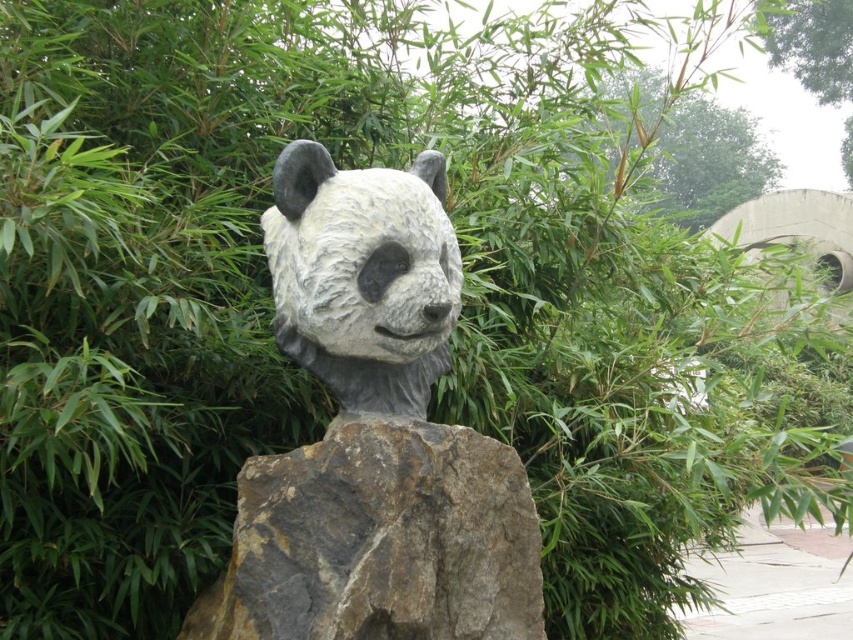
Question: Which object appears farthest from the camera in this image?

Choices:
 (A) gray rough rock at center
 (B) white stone panda head at center
 (C) green leafy tree at upper right

Answer: (C)

Question: Which object is closer to the camera taking this photo?

Choices:
 (A) gray rough rock at center
 (B) green leafy tree at upper right
 (C) white stone panda head at center

Answer: (C)

Question: Which point is closer to the camera taking this photo?

Choices:
 (A) (512, 609)
 (B) (711, 102)
 (C) (795, 17)

Answer: (A)

Question: Is white stone panda head at center below green bamboo at upper center?

Choices:
 (A) yes
 (B) no

Answer: (A)

Question: Is white stone panda head at center below green leafy tree at upper right?

Choices:
 (A) yes
 (B) no

Answer: (A)

Question: Can you confirm if white stone panda head at center is positioned to the right of green bamboo at upper center?

Choices:
 (A) yes
 (B) no

Answer: (B)